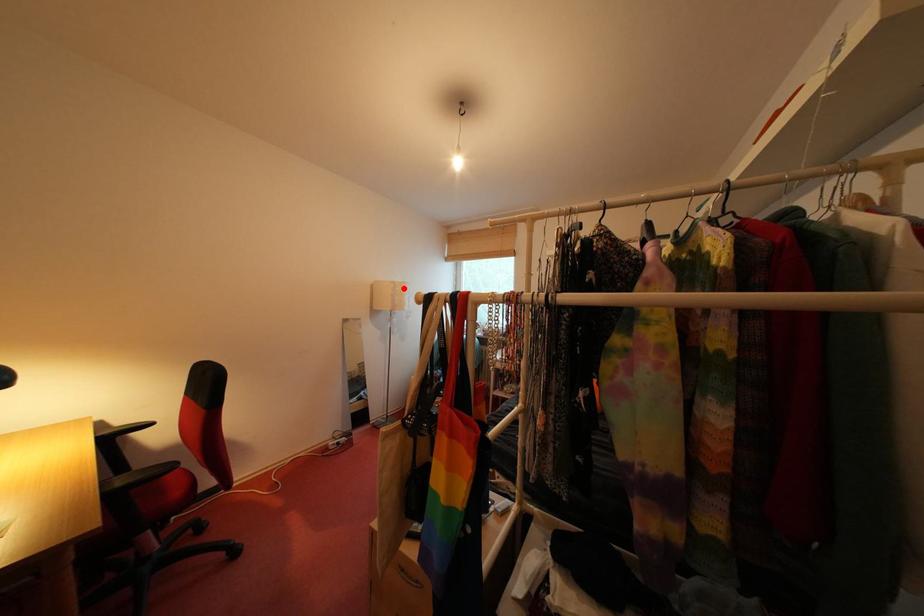
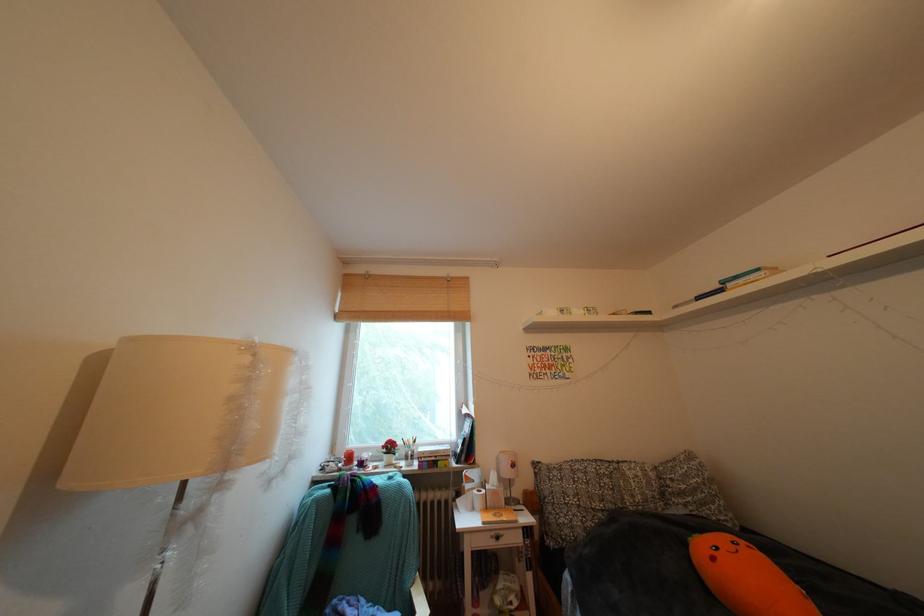
Question: I am providing you with two images of the same scene from different viewpoints. In image1, a red point is highlighted. Considering the same 3D point in image2, which of the following is correct?

Choices:
 (A) It is closer
 (B) It is farther

Answer: (B)